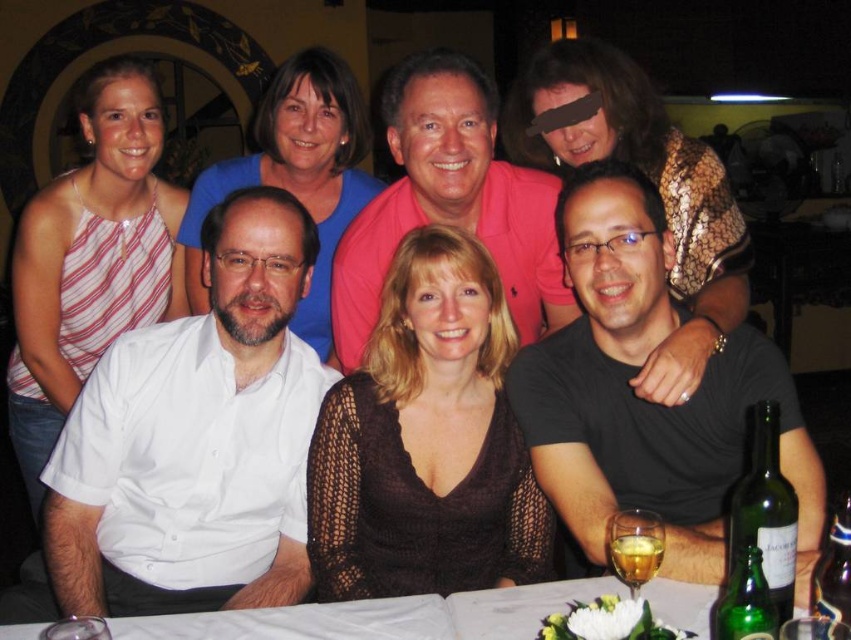
Question: Among these objects, which one is nearest to the camera?

Choices:
 (A) green glass bottle at lower right
 (B) white shirt at left
 (C) green glass beer at lower right
 (D) white tablecloth at lower center

Answer: (A)

Question: Which point is farther to the camera?

Choices:
 (A) (184, 436)
 (B) (638, 568)
 (C) (683, 570)
 (D) (366, 298)

Answer: (D)

Question: Is black matte shirt at center further to the viewer compared to white tablecloth at lower center?

Choices:
 (A) yes
 (B) no

Answer: (A)

Question: Does black matte shirt at center have a smaller size compared to green glass beer at lower right?

Choices:
 (A) yes
 (B) no

Answer: (B)

Question: Which of the following is the farthest from the observer?

Choices:
 (A) white shirt at left
 (B) black matte shirt at center

Answer: (A)

Question: Does white shirt at left appear on the left side of white tablecloth at lower center?

Choices:
 (A) yes
 (B) no

Answer: (A)